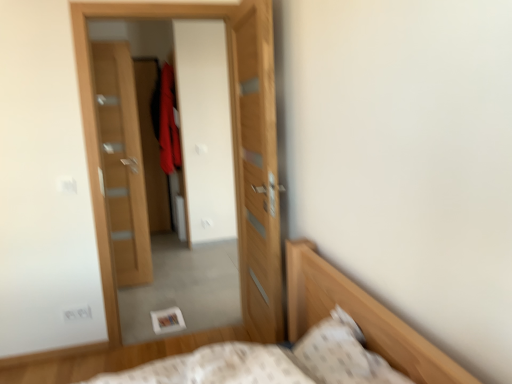
Measure the distance between point (162,122) and camera.

4.88 meters.

The height and width of the screenshot is (384, 512). Describe the element at coordinates (122, 163) in the screenshot. I see `wooden door at left, the third door in the front-to-back sequence` at that location.

Locate an element on the screen. Image resolution: width=512 pixels, height=384 pixels. white textured pillow at lower right is located at coordinates (343, 354).

Considering the relative sizes of wooden door at center, the 2th door when ordered from right to left, and velvet red robe at center in the image provided, is wooden door at center, the 2th door when ordered from right to left, shorter than velvet red robe at center?

Incorrect, the height of wooden door at center, the 2th door when ordered from right to left, does not fall short of that of velvet red robe at center.

Which object is closer to the camera taking this photo, wooden door at center, which ranks as the second door in back-to-front order, or velvet red robe at center?

Positioned in front is wooden door at center, which ranks as the second door in back-to-front order.

Considering the positions of objects wooden door at center, the 2th door when ordered from right to left, and velvet red robe at center in the image provided, who is more to the left, wooden door at center, the 2th door when ordered from right to left, or velvet red robe at center?

From the viewer's perspective, velvet red robe at center appears more on the left side.

Which object is positioned more to the left, wooden door at center, the 3th door when ordered from back to front, or white textured pillow at lower right?

Positioned to the left is wooden door at center, the 3th door when ordered from back to front.

Does wooden door at center, the first door in the front-to-back sequence, contain white textured pillow at lower right?

No, white textured pillow at lower right is not surrounded by wooden door at center, the first door in the front-to-back sequence.

Which object is wider, velvet red robe at center or wooden door at center, arranged as the 2th door when viewed from the left?

velvet red robe at center is wider.

Is wooden door at center, arranged as the 2th door when viewed from the left, completely or partially inside velvet red robe at center?

That's incorrect, wooden door at center, arranged as the 2th door when viewed from the left, is not inside velvet red robe at center.

What's the angular difference between velvet red robe at center and wooden door at center, the 2th door when ordered from right to left,'s facing directions?

velvet red robe at center and wooden door at center, the 2th door when ordered from right to left, are facing 92.3 degrees away from each other.

From a real-world perspective, is velvet red robe at center physically below wooden door at center, which ranks as the second door in back-to-front order?

No.

Considering the relative positions of wooden door at center, arranged as the 2th door when viewed from the left, and wooden door at left, which appears as the first door when viewed from the left, in the image provided, is wooden door at center, arranged as the 2th door when viewed from the left, behind wooden door at left, which appears as the first door when viewed from the left,?

No, wooden door at center, arranged as the 2th door when viewed from the left, is closer to the viewer.

In the scene shown: Considering the sizes of objects wooden door at center, arranged as the 2th door when viewed from the front, and wooden door at left, which is the 1th door from back to front, in the image provided, who is smaller, wooden door at center, arranged as the 2th door when viewed from the front, or wooden door at left, which is the 1th door from back to front,?

With smaller size is wooden door at left, which is the 1th door from back to front.

Which of these two, wooden door at center, which ranks as the second door in back-to-front order, or wooden door at left, the third door in the front-to-back sequence, stands taller?

With more height is wooden door at center, which ranks as the second door in back-to-front order.

Is wooden door at center, arranged as the 2th door when viewed from the front, turned away from wooden door at left, the third door in the right-to-left sequence?

That's right, wooden door at center, arranged as the 2th door when viewed from the front, is facing away from wooden door at left, the third door in the right-to-left sequence.

Considering the points (378, 381) and (276, 301), which point is in front, point (378, 381) or point (276, 301)?

The point (378, 381) is closer to the camera.

Does white textured pillow at lower right turn towards wooden door at center, arranged as the 2th door when viewed from the front?

No, white textured pillow at lower right is not turned towards wooden door at center, arranged as the 2th door when viewed from the front.

In the scene shown: From a real-world perspective, does white textured pillow at lower right stand above wooden door at center, arranged as the 2th door when viewed from the left?

No, from a real-world perspective, white textured pillow at lower right is not over wooden door at center, arranged as the 2th door when viewed from the left

In the image, is white textured pillow at lower right positioned in front of or behind wooden door at center, the 2th door when ordered from right to left?

Visually, white textured pillow at lower right is located in front of wooden door at center, the 2th door when ordered from right to left.

Is point (170, 67) farther from camera compared to point (298, 344)?

Yes, point (170, 67) is behind point (298, 344).

Which object is further away from the camera taking this photo, velvet red robe at center or white textured pillow at lower right?

velvet red robe at center is more distant.

Is velvet red robe at center touching white textured pillow at lower right?

There is a gap between velvet red robe at center and white textured pillow at lower right.

Identify the location of the 2nd door below the velvet red robe at center (from a real-world perspective). The height and width of the screenshot is (384, 512). click(x=256, y=167).

Measure the distance between wooden door at center, the 3th door when ordered from back to front, and velvet red robe at center.

wooden door at center, the 3th door when ordered from back to front, and velvet red robe at center are 7.14 feet apart from each other.

Is wooden door at center, which appears as the 1th door when viewed from the right, in front of or behind velvet red robe at center in the image?

Clearly, wooden door at center, which appears as the 1th door when viewed from the right, is in front of velvet red robe at center.

Between wooden door at center, the 3th door when ordered from back to front, and velvet red robe at center, which one has larger width?

With larger width is velvet red robe at center.

Starting from the velvet red robe at center, which door is the 1st one to the right? Please provide its 2D coordinates.

[(233, 150)]

You are a GUI agent. You are given a task and a screenshot of the screen. Output one action in this format:
    pyautogui.click(x=<x>, y=<y>)
    Task: Click on the pillow below the wooden door at center, which appears as the 1th door when viewed from the right (from a real-world perspective)
    Image resolution: width=512 pixels, height=384 pixels.
    Given the screenshot: What is the action you would take?
    pyautogui.click(x=343, y=354)

Based on their spatial positions, is wooden door at center, the 2th door when ordered from right to left, or white textured pillow at lower right further from wooden door at left, which is the 1th door from back to front?

Among the two, white textured pillow at lower right is located further to wooden door at left, which is the 1th door from back to front.

Estimate the real-world distances between objects in this image. Which object is further from wooden door at left, the third door in the front-to-back sequence, wooden door at center, the first door in the front-to-back sequence, or velvet red robe at center?

wooden door at center, the first door in the front-to-back sequence.

From the picture: Estimate the real-world distances between objects in this image. Which object is further from wooden door at left, which is the 1th door from back to front, white textured pillow at lower right or wooden door at center, arranged as the 2th door when viewed from the left?

Among the two, white textured pillow at lower right is located further to wooden door at left, which is the 1th door from back to front.

Considering their positions, is wooden door at center, arranged as the 2th door when viewed from the front, positioned further to velvet red robe at center than wooden door at left, which is the 1th door from back to front?

The object further to velvet red robe at center is wooden door at center, arranged as the 2th door when viewed from the front.

Considering their positions, is velvet red robe at center positioned closer to wooden door at center, which ranks as the second door in back-to-front order, than wooden door at left, the third door in the right-to-left sequence?

Based on the image, wooden door at left, the third door in the right-to-left sequence, appears to be nearer to wooden door at center, which ranks as the second door in back-to-front order.

Considering their positions, is wooden door at left, the third door in the front-to-back sequence, positioned further to wooden door at center, arranged as the 2th door when viewed from the front, than white textured pillow at lower right?

The object further to wooden door at center, arranged as the 2th door when viewed from the front, is white textured pillow at lower right.

When comparing their distances from white textured pillow at lower right, does velvet red robe at center or wooden door at center, acting as the third door starting from the left, seem closer?

wooden door at center, acting as the third door starting from the left, is closer to white textured pillow at lower right.

From the picture: Which object lies further to the anchor point white textured pillow at lower right, wooden door at left, the third door in the front-to-back sequence, or wooden door at center, the first door in the front-to-back sequence?

wooden door at left, the third door in the front-to-back sequence, lies further to white textured pillow at lower right than the other object.

Image resolution: width=512 pixels, height=384 pixels. What are the coordinates of `door between white textured pillow at lower right and wooden door at center, the 2th door when ordered from right to left, in the front-back direction` in the screenshot? It's located at (256, 167).

I want to click on door positioned between wooden door at center, the 3th door when ordered from back to front, and wooden door at left, which appears as the first door when viewed from the left, from near to far, so click(233, 150).

The image size is (512, 384). Find the location of `door located between wooden door at center, which ranks as the second door in back-to-front order, and velvet red robe at center in the depth direction`. door located between wooden door at center, which ranks as the second door in back-to-front order, and velvet red robe at center in the depth direction is located at coordinates (122, 163).